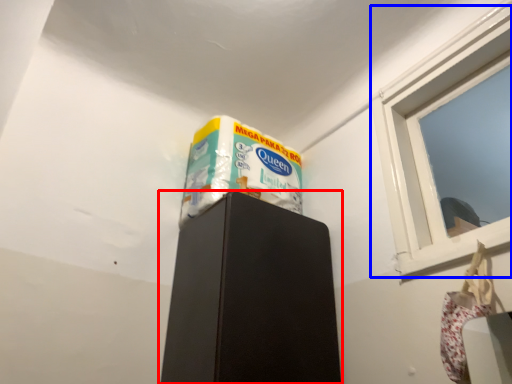
Question: Which object is closer to the camera taking this photo, furniture (highlighted by a red box) or window (highlighted by a blue box)?

Choices:
 (A) furniture
 (B) window

Answer: (B)